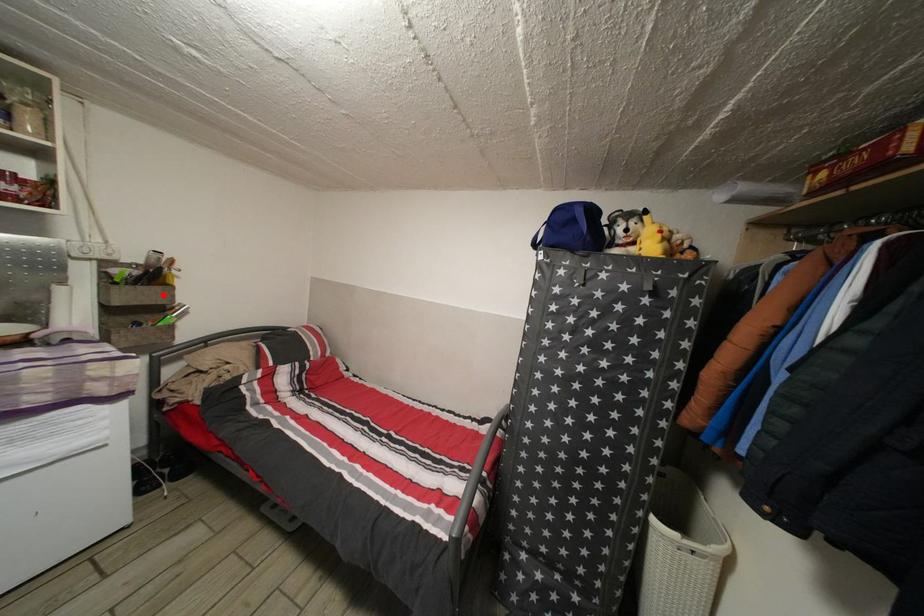
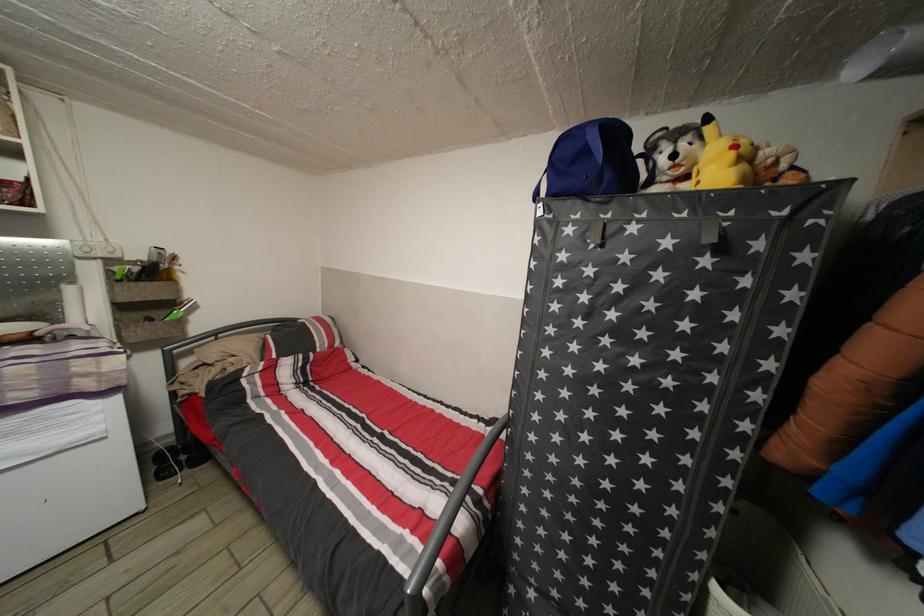
In the second image, find the point that corresponds to the highlighted location in the first image.

(164, 291)